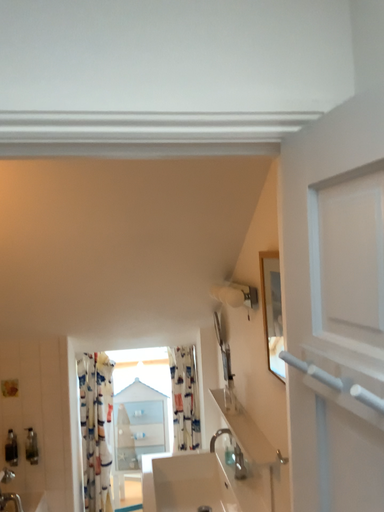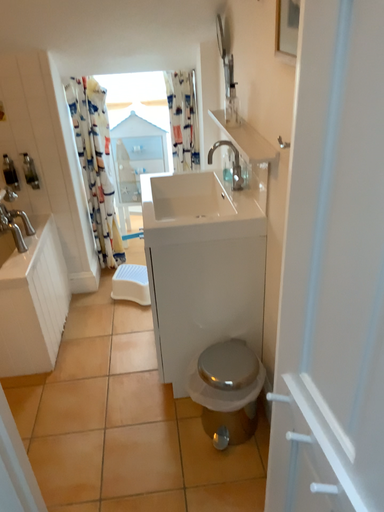
Question: Which way did the camera rotate in the video?

Choices:
 (A) rotated downward
 (B) rotated upward

Answer: (A)